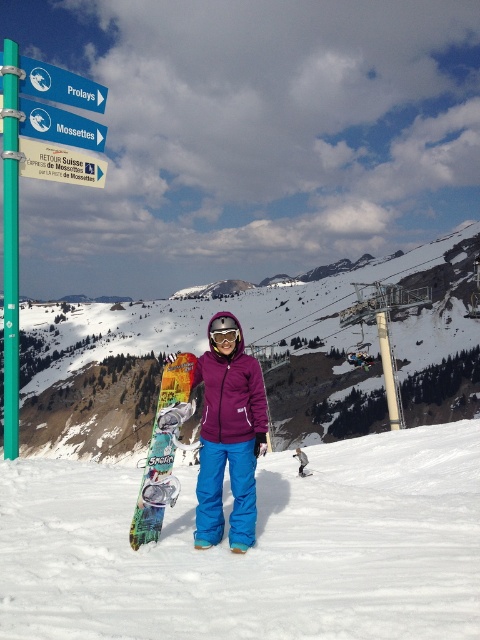
You are standing at the base of the mountain and want to take a photo of the point at coordinates [182,396]. If your camera has a maximum range of 30 meters, will you be able to capture the point in your photo?

The point at coordinates [182,396] is 32.75 meters away from the viewer. Since the camera can only capture up to 30 meters, the point will be out of range and cannot be captured in the photo.

You are a snowboarder trying to decide whether to carry your white snowboard at center or the teal glossy pole at left while navigating through the narrow paths of the ski resort. Based on their sizes, which item is wider and would be harder to maneuver?

The white snowboard at center is wider than the teal glossy pole at left, so it would be harder to maneuver through narrow paths.